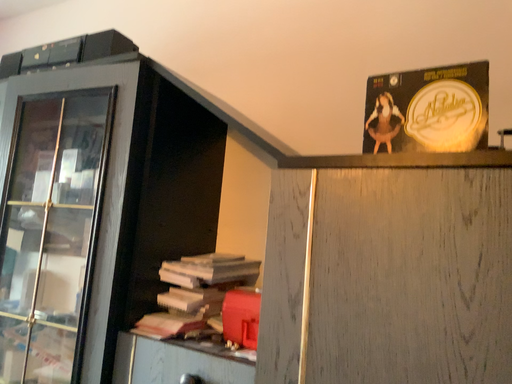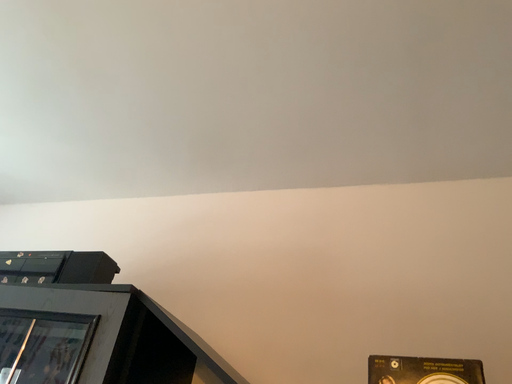
Question: How did the camera likely rotate when shooting the video?

Choices:
 (A) rotated downward
 (B) rotated upward

Answer: (B)